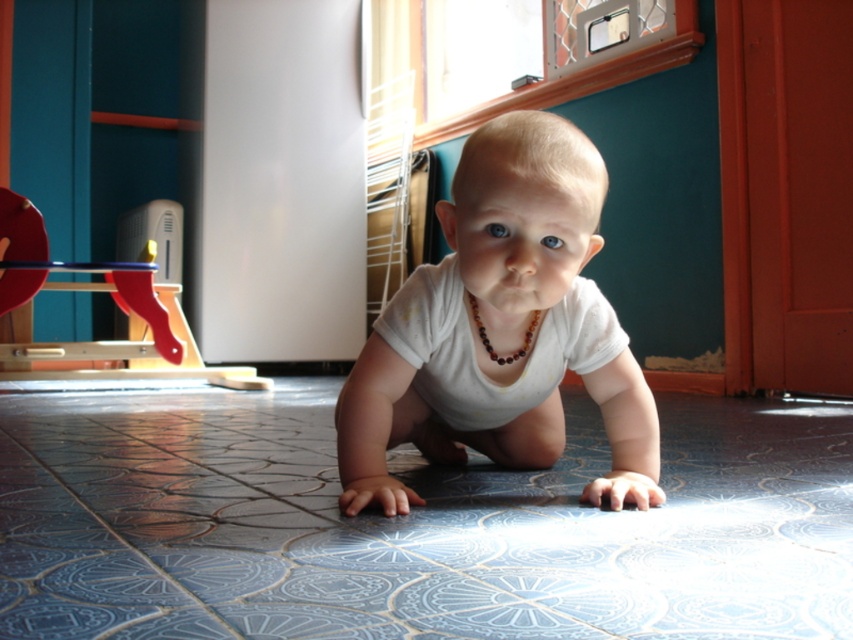
Who is shorter, blue textured tile at center or wooden toy at left?

Standing shorter between the two is blue textured tile at center.

Is point (79, 634) closer to viewer compared to point (54, 356)?

Yes, it is.

Where is `blue textured tile at center`? The height and width of the screenshot is (640, 853). blue textured tile at center is located at coordinates (412, 525).

Who is shorter, white matte onesie at center or wooden toy at left?

white matte onesie at center

Image resolution: width=853 pixels, height=640 pixels. Describe the element at coordinates (480, 307) in the screenshot. I see `white matte onesie at center` at that location.

What do you see at coordinates (480, 307) in the screenshot? I see `white matte onesie at center` at bounding box center [480, 307].

The width and height of the screenshot is (853, 640). I want to click on white matte onesie at center, so click(480, 307).

Can you confirm if blue textured tile at center is thinner than white matte onesie at center?

In fact, blue textured tile at center might be wider than white matte onesie at center.

From the picture: Which of these two, blue textured tile at center or white matte onesie at center, stands shorter?

blue textured tile at center

Between point (260, 595) and point (531, 157), which one is positioned behind?

The point (531, 157) is behind.

At what (x,y) coordinates should I click in order to perform the action: click on blue textured tile at center. Please return your answer as a coordinate pair (x, y). The height and width of the screenshot is (640, 853). Looking at the image, I should click on (412, 525).